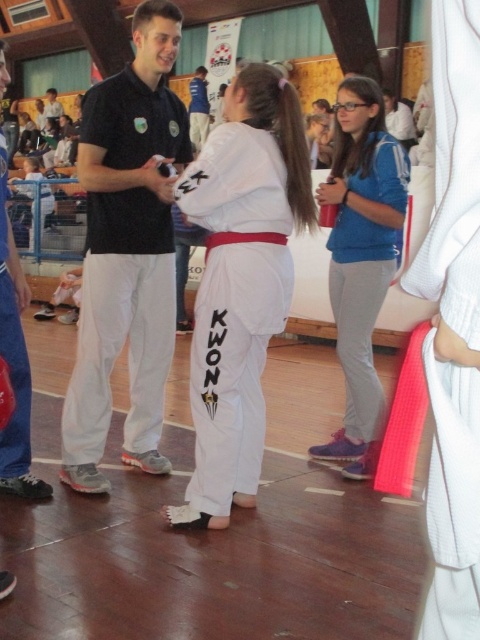
Is black matte shirt at center positioned behind white cotton karate gi at center?

Yes, it is behind white cotton karate gi at center.

Does black matte shirt at center lie in front of white cotton karate gi at center?

That is False.

Does point (166, 276) come behind point (203, 292)?

Yes, point (166, 276) is farther from viewer.

The height and width of the screenshot is (640, 480). I want to click on black matte shirt at center, so click(x=127, y=252).

Which of these two, blue fleece jacket at center or black fabric referee at left, stands shorter?

Standing shorter between the two is black fabric referee at left.

Between point (384, 170) and point (38, 497), which one is positioned behind?

The point (384, 170) is more distant.

Identify the location of blue fleece jacket at center. Image resolution: width=480 pixels, height=640 pixels. (360, 259).

What do you see at coordinates (127, 252) in the screenshot?
I see `black matte shirt at center` at bounding box center [127, 252].

Between point (132, 380) and point (15, 269), which one is positioned behind?

The point (132, 380) is more distant.

Where is `black matte shirt at center`? The height and width of the screenshot is (640, 480). black matte shirt at center is located at coordinates (127, 252).